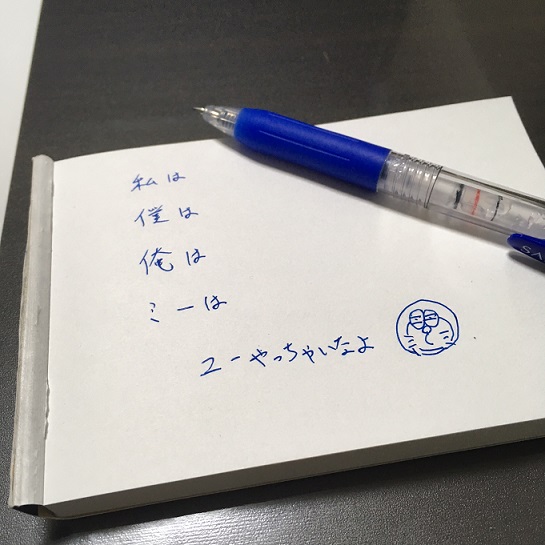
Locate an element on the screen. Image resolution: width=545 pixels, height=545 pixels. pen is located at coordinates (352, 168).